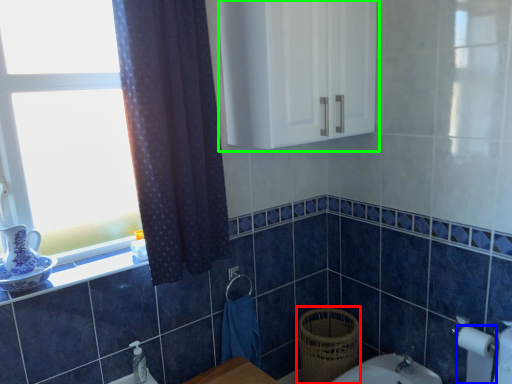
Question: Based on their relative distances, which object is farther from basket (highlighted by a red box)? Choose from toilet paper (highlighted by a blue box) and medicine cabinet (highlighted by a green box).

Choices:
 (A) toilet paper
 (B) medicine cabinet

Answer: (B)